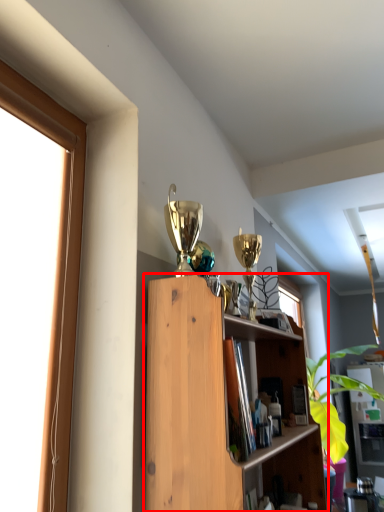
Question: From the image's perspective, where is shelf (annotated by the red box) located relative to cabinet?

Choices:
 (A) above
 (B) below

Answer: (A)